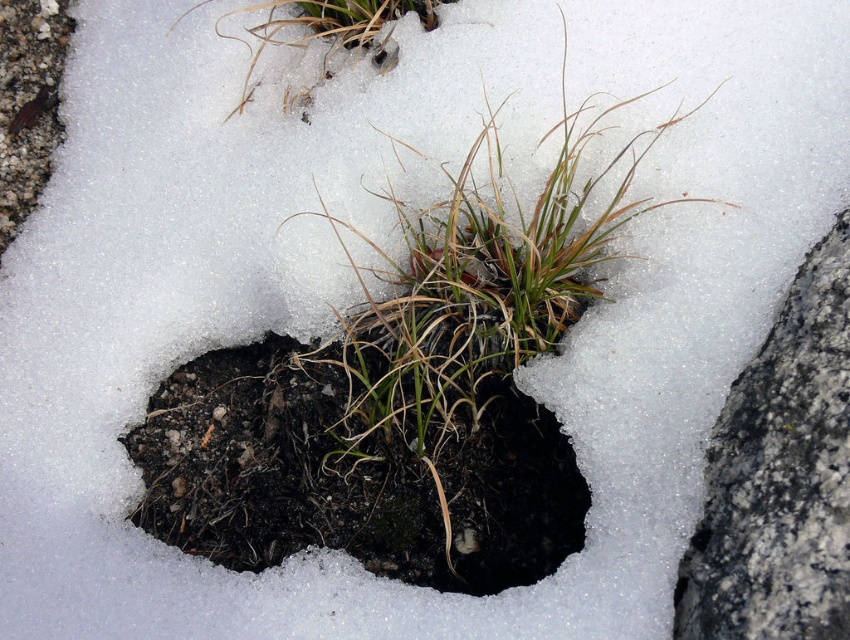
You are a geologist examining the soil patch. You need to collect a sample from the gray rough rock at right. What are the coordinates where you should collect the sample?

The gray rough rock at right is located at coordinates point (780,476), so you should collect the sample at point (780,476).

You are a gardener trying to plant a new shrub. You need to know which object is taller between the gray rough rock at right and the dry grass at upper center to determine where to dig. Can you tell me which one is taller?

The gray rough rock at right is much taller than the dry grass at upper center, so you should dig around the gray rough rock at right since it is taller and may require more space.